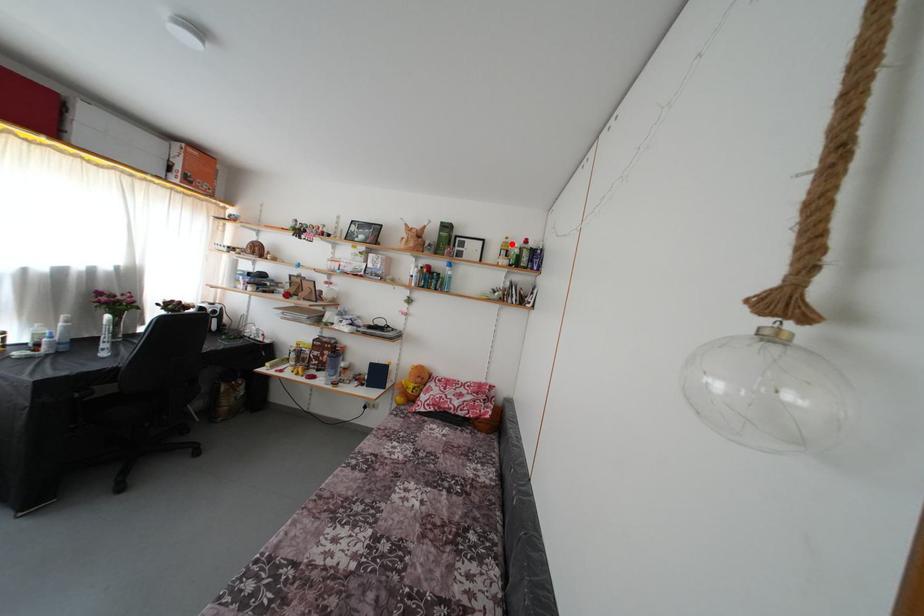
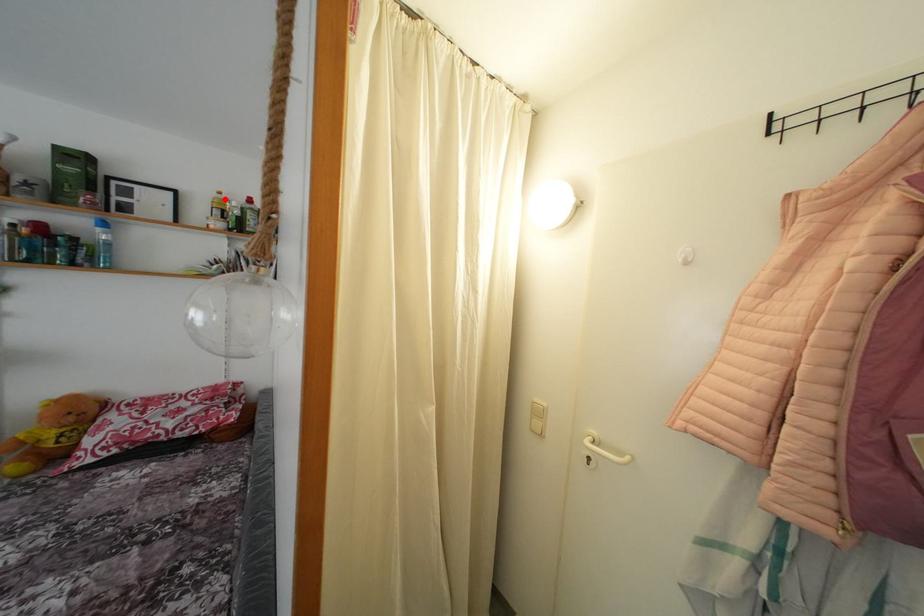
From the picture: I am providing you with two images of the same scene from different viewpoints. A red point is marked on the first image and another point is marked on the second image. Is the red point in image1 aligned with the point shown in image2?

Yes